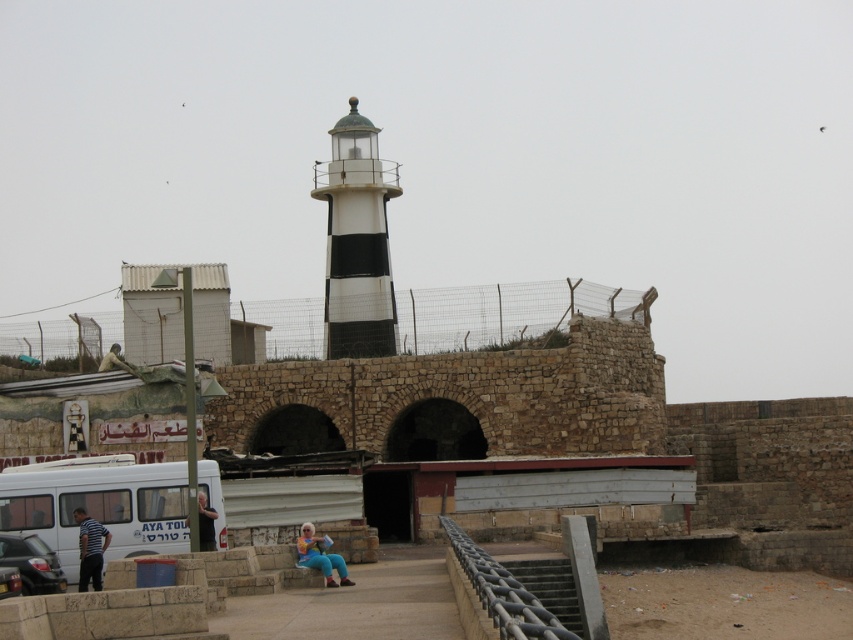
Is metallic gray stairs at lower center smaller than striped cotton shirt at lower left?

Incorrect, metallic gray stairs at lower center is not smaller in size than striped cotton shirt at lower left.

Is metallic gray stairs at lower center closer to camera compared to striped cotton shirt at lower left?

No, it is not.

Which is in front, point (515, 560) or point (84, 509)?

Positioned in front is point (84, 509).

Find the location of a particular element. metallic gray stairs at lower center is located at coordinates (550, 588).

Between point (509, 588) and point (200, 515), which one is positioned in front?

Positioned in front is point (509, 588).

Who is higher up, metallic chain-link rail at center or blue jeans at lower center?

blue jeans at lower center is above.

Is point (448, 522) positioned after point (202, 548)?

Yes, point (448, 522) is behind point (202, 548).

I want to click on metallic chain-link rail at center, so click(x=503, y=593).

Based on the photo, who is more distant from viewer, (494, 604) or (85, 572)?

The point (85, 572) is behind.

Based on the photo, who is positioned more to the right, metallic chain-link rail at center or striped cotton shirt at lower left?

metallic chain-link rail at center

Which is behind, point (531, 627) or point (105, 545)?

The point (105, 545) is more distant.

Locate an element on the screen. The image size is (853, 640). metallic chain-link rail at center is located at coordinates (503, 593).